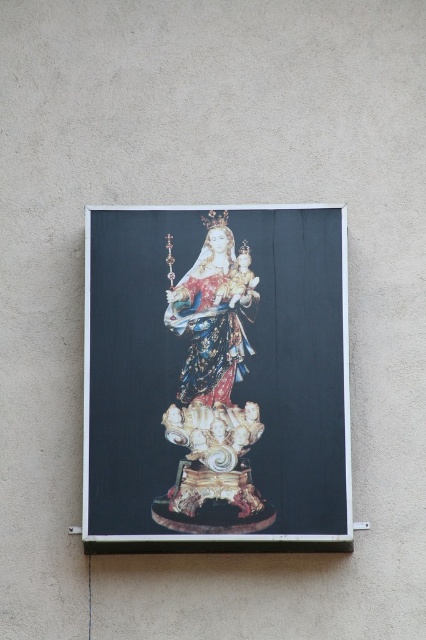
Question: Where is gold-gilded statue at center located in relation to shiny gold statue at center in the image?

Choices:
 (A) left
 (B) right

Answer: (A)

Question: Which point is closer to the camera taking this photo?

Choices:
 (A) click(x=235, y=314)
 (B) click(x=333, y=499)

Answer: (B)

Question: Which object is farther from the camera taking this photo?

Choices:
 (A) gold-gilded statue at center
 (B) shiny gold statue at center

Answer: (B)

Question: Can you confirm if gold-gilded statue at center is bigger than shiny gold statue at center?

Choices:
 (A) yes
 (B) no

Answer: (A)

Question: Does gold-gilded statue at center have a larger size compared to shiny gold statue at center?

Choices:
 (A) yes
 (B) no

Answer: (A)